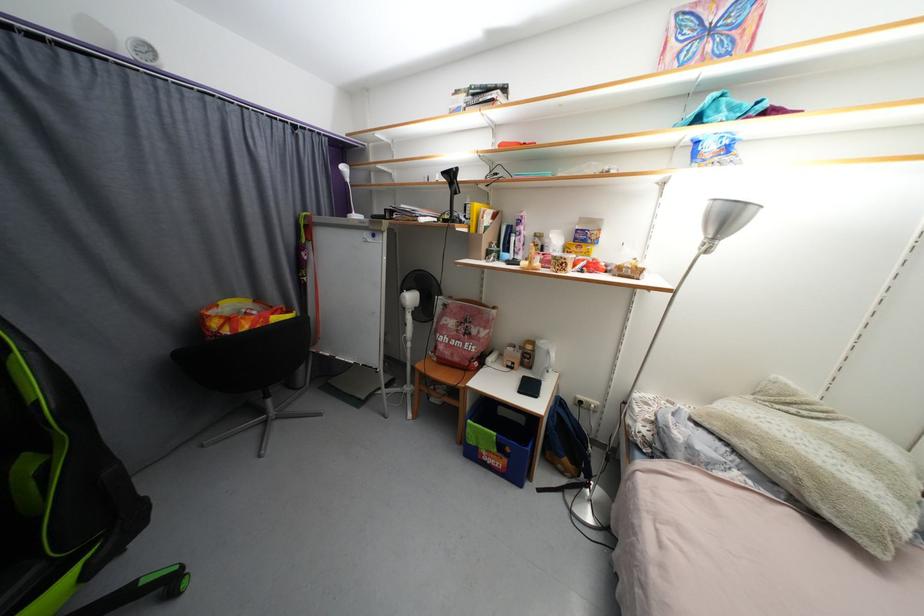
The image size is (924, 616). I want to click on brown coffee canister, so click(527, 353).